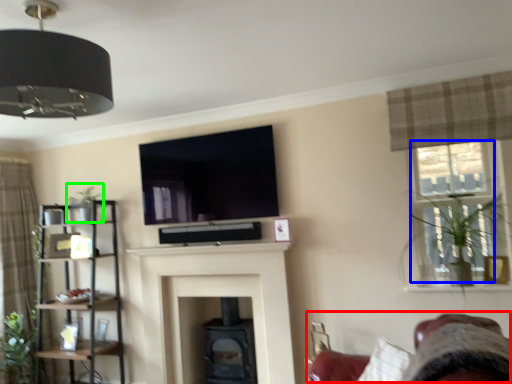
Question: Based on their relative distances, which object is nearer to swivel chair (highlighted by a red box)? Choose from window (highlighted by a blue box) and plant (highlighted by a green box).

Choices:
 (A) window
 (B) plant

Answer: (A)